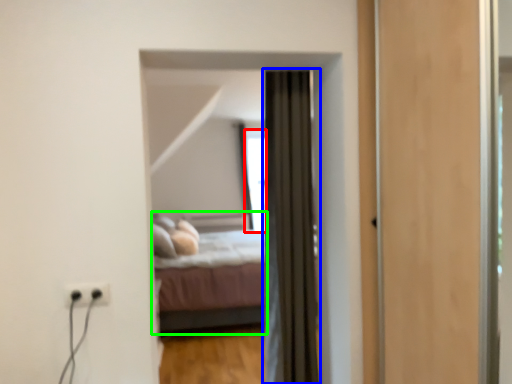
Question: Based on their relative distances, which object is nearer to window (highlighted by a red box)? Choose from curtain (highlighted by a blue box) and bed (highlighted by a green box).

Choices:
 (A) curtain
 (B) bed

Answer: (B)